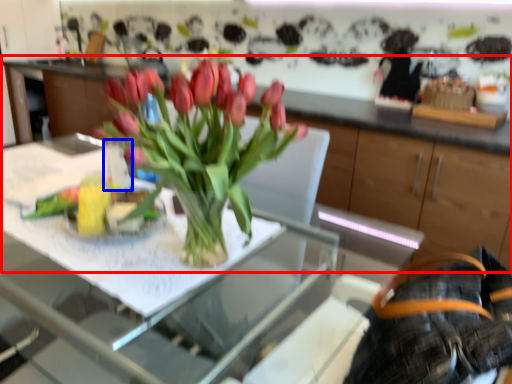
Question: Which point is further to the camera, cabinetry (highlighted by a red box) or vase (highlighted by a blue box)?

Choices:
 (A) cabinetry
 (B) vase

Answer: (B)